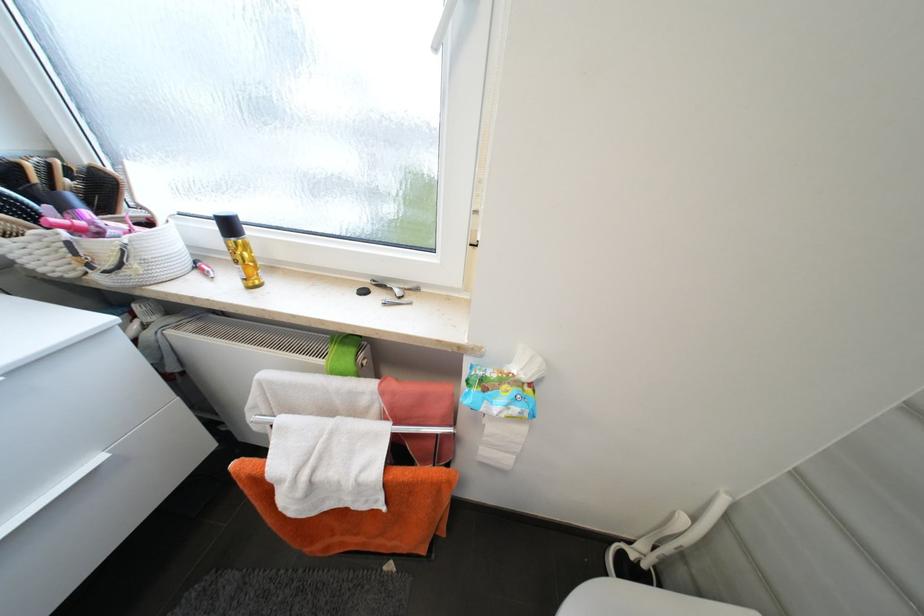
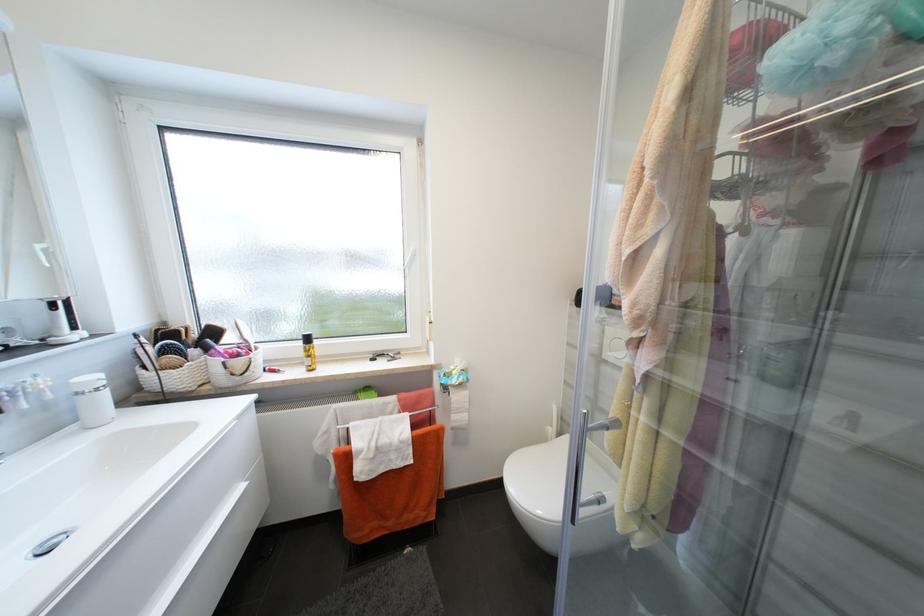
First-person continuous shooting, in which direction is the camera rotating?

The camera rotated toward right-up.